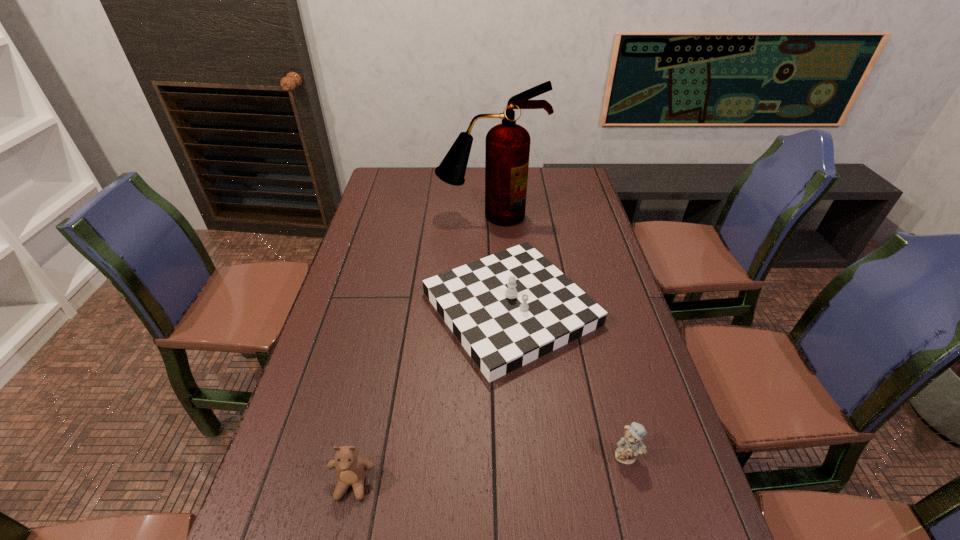
This screenshot has height=540, width=960. In order to click on free space between the checkerboard and the right teddy bear in this screenshot , I will do `click(568, 382)`.

Find the location of a particular element. This screenshot has height=540, width=960. object that is the third closest to the tallest object is located at coordinates (351, 468).

The height and width of the screenshot is (540, 960). I want to click on the closest object relative to the right teddy bear, so click(508, 309).

I want to click on vacant position in the image that satisfies the following two spatial constraints: 1. at the nozzle of the tallest object; 2. on the right side of the checkerboard, so click(492, 308).

Locate an element on the screen. vacant space that satisfies the following two spatial constraints: 1. at the nozzle of the fire extinguisher; 2. on the right side of the checkerboard is located at coordinates (492, 308).